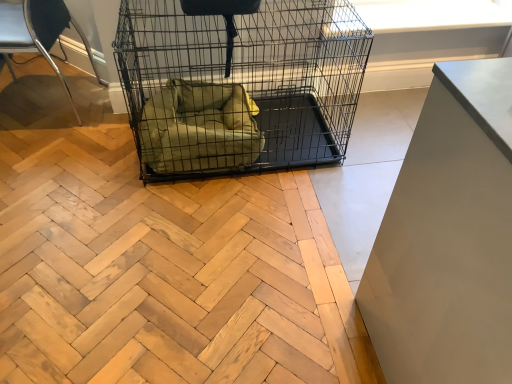
The height and width of the screenshot is (384, 512). I want to click on free space to the left of green fabric dog bed at center, so click(87, 159).